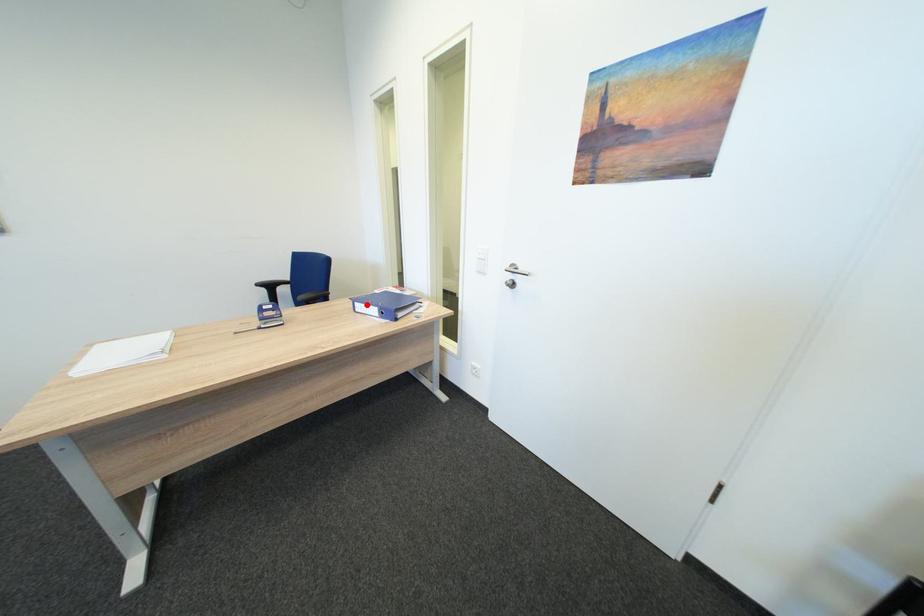
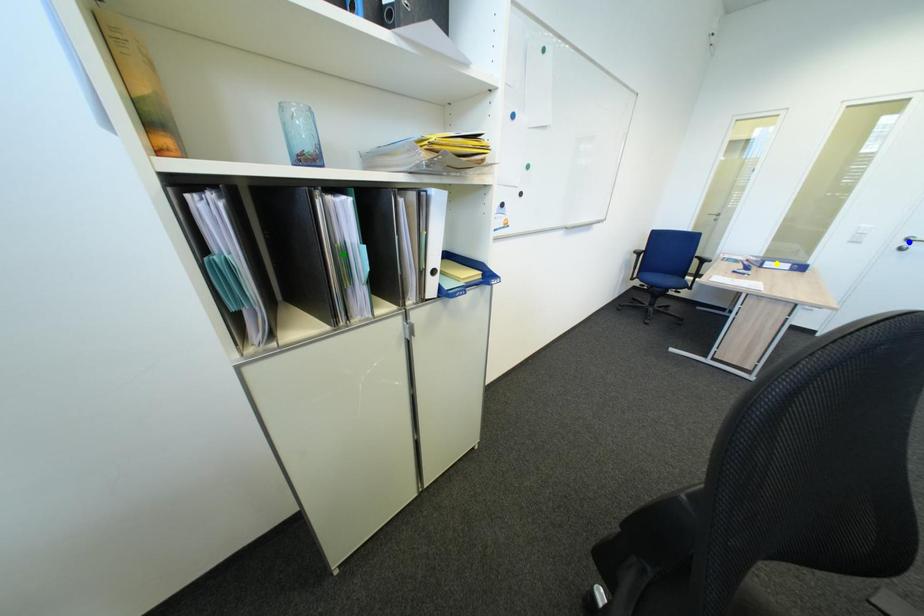
Question: I am providing you with two images of the same scene from different viewpoints. A red point is marked on the first image. You are given multiple points on the second image. Which spot in image 2 lines up with the point in image 1?

Choices:
 (A) green point
 (B) blue point
 (C) yellow point

Answer: (C)